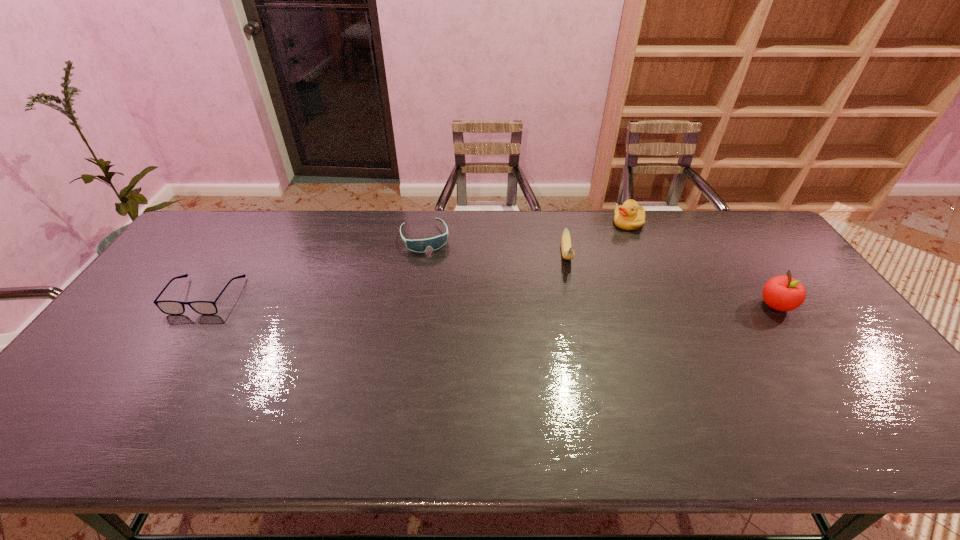
Image resolution: width=960 pixels, height=540 pixels. What are the coordinates of `vacant spot on the desktop that is between the spectacles and the tallest object and is positioned at the stem of the banana` in the screenshot? It's located at (572, 302).

At what (x,y) coordinates should I click in order to perform the action: click on vacant spot on the desktop that is between the spectacles and the tallest object and is positioned on the front-facing side of the fourth object from right to left. Please return your answer as a coordinate pair (x, y). Looking at the image, I should click on (445, 300).

Locate an element on the screen. The width and height of the screenshot is (960, 540). vacant space on the desktop that is between the spectacles and the rightmost object and is positioned on the front-facing side of the fourth object from left to right is located at coordinates (x=560, y=302).